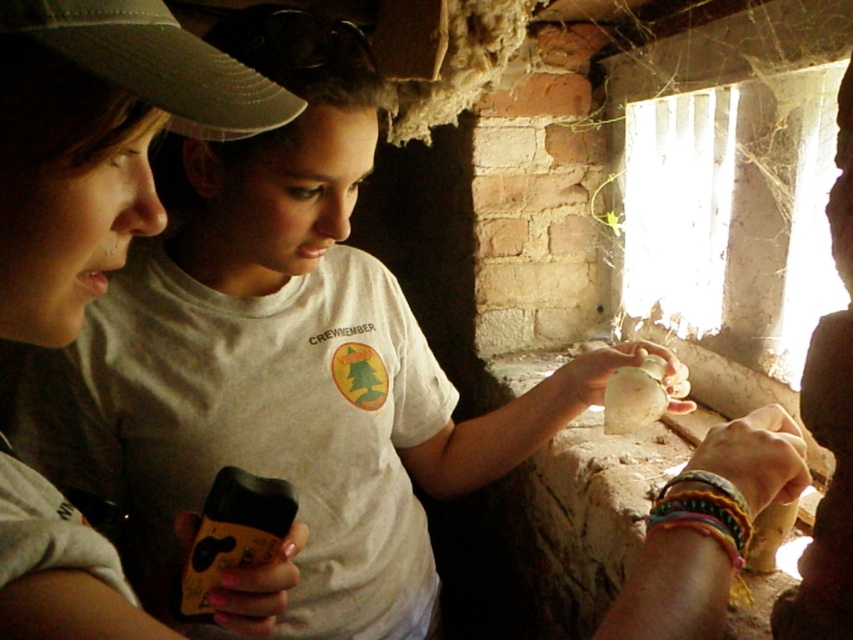
Does white matte shirt at center appear over translucent glass bottle at center?

Correct, white matte shirt at center is located above translucent glass bottle at center.

You are a GUI agent. You are given a task and a screenshot of the screen. Output one action in this format:
    pyautogui.click(x=<x>, y=<y>)
    Task: Click on the white matte shirt at center
    The image size is (853, 640).
    Given the screenshot: What is the action you would take?
    pyautogui.click(x=91, y=145)

I want to click on white matte shirt at center, so click(91, 145).

Does white matte shirt at center appear on the left side of dark gray fabric baseball cap at upper left?

Correct, you'll find white matte shirt at center to the left of dark gray fabric baseball cap at upper left.

What do you see at coordinates (91, 145) in the screenshot?
I see `white matte shirt at center` at bounding box center [91, 145].

Where is `white matte shirt at center`? white matte shirt at center is located at coordinates (91, 145).

Between point (138, 28) and point (200, 596), which one is positioned in front?

Point (138, 28) is in front.

Does dark gray fabric baseball cap at upper left come in front of yellow matte smartphone at lower left?

Yes, it is.

Is point (65, 54) positioned after point (186, 614)?

That is False.

Find the location of a particular element. The width and height of the screenshot is (853, 640). dark gray fabric baseball cap at upper left is located at coordinates (155, 64).